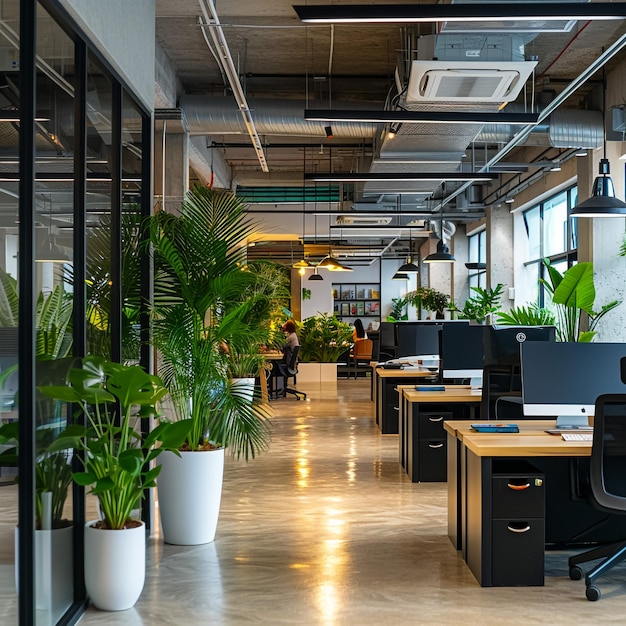
Find the location of a particular element. The height and width of the screenshot is (626, 626). black  computer screens sitting on wooden table tops is located at coordinates point(568,369), point(412,334).